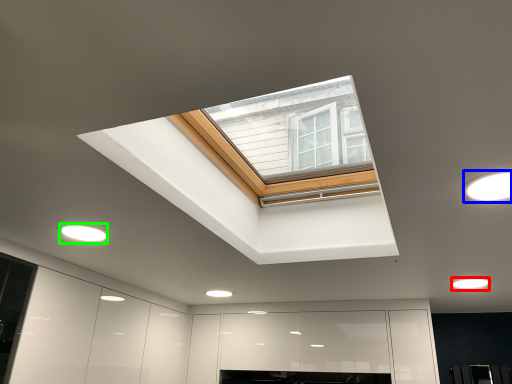
Question: Based on their relative distances, which object is farther from lighting (highlighted by a red box)? Choose from lighting (highlighted by a blue box) and lighting (highlighted by a green box).

Choices:
 (A) lighting
 (B) lighting

Answer: (B)